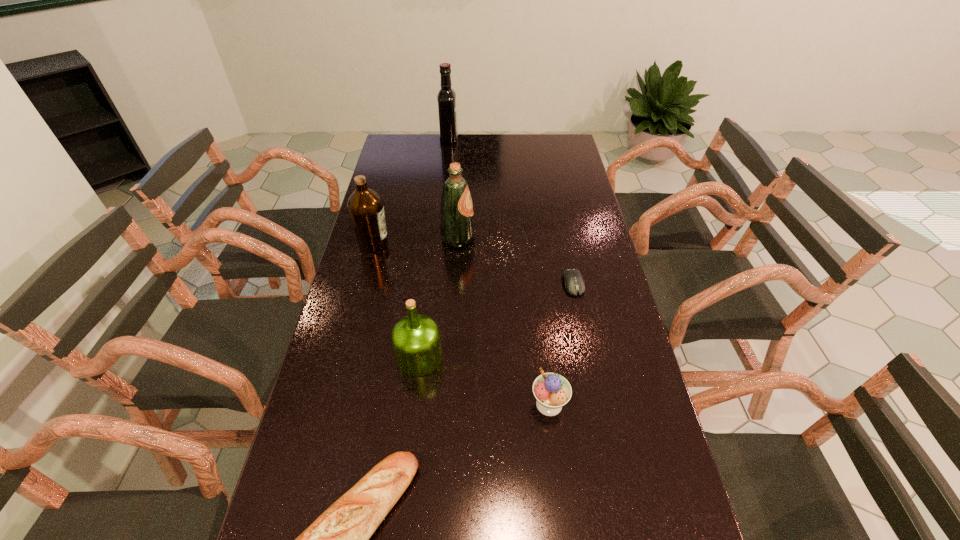
This screenshot has height=540, width=960. What are the coordinates of `liquor` in the screenshot? It's located at (446, 97).

Locate an element on the screen. Image resolution: width=960 pixels, height=540 pixels. the leftmost olive oil is located at coordinates (366, 209).

The height and width of the screenshot is (540, 960). In order to click on the shortest olive oil in this screenshot , I will do `click(416, 341)`.

You are a GUI agent. You are given a task and a screenshot of the screen. Output one action in this format:
    pyautogui.click(x=<x>, y=<y>)
    Task: Click on the third nearest object
    
    Given the screenshot: What is the action you would take?
    pyautogui.click(x=416, y=341)

Locate an element on the screen. The height and width of the screenshot is (540, 960). icecream is located at coordinates (552, 391).

This screenshot has height=540, width=960. In order to click on the second nearest object in this screenshot , I will do `click(552, 391)`.

This screenshot has width=960, height=540. Find the location of `computer equipment`. computer equipment is located at coordinates (574, 283).

Identify the location of the shortest object. (574, 283).

Identify the location of vacant region located 0.180m on the front-facing side of the liquor. The height and width of the screenshot is (540, 960). (496, 139).

This screenshot has height=540, width=960. I want to click on blank space located 0.240m on the label of the leftmost olive oil, so click(x=460, y=244).